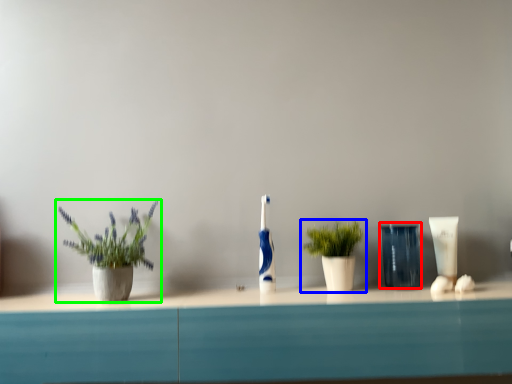
Question: Considering the real-world distances, which object is closest to glass vase (highlighted by a red box)? houseplant (highlighted by a blue box) or houseplant (highlighted by a green box).

Choices:
 (A) houseplant
 (B) houseplant

Answer: (A)